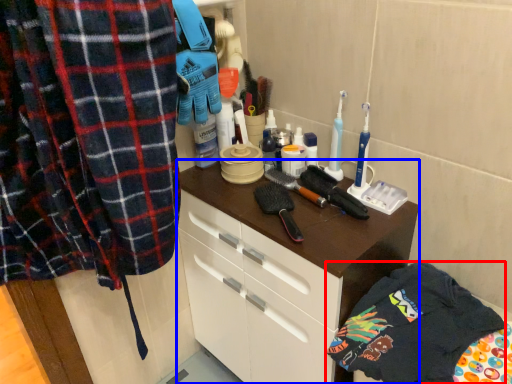
Question: Among these objects, which one is farthest to the camera, clothing (highlighted by a red box) or cabinetry (highlighted by a blue box)?

Choices:
 (A) clothing
 (B) cabinetry

Answer: (B)